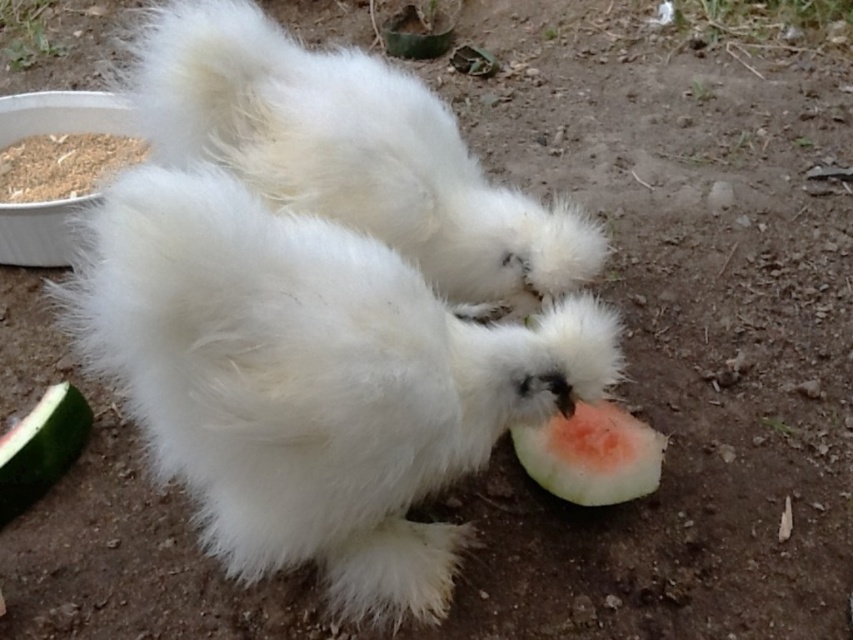
You are standing at the point with coordinates point (86, 413) and want to walk to the point with coordinates point (515, 452). Which direction should you move in?

You should move forward because point (515, 452) is in front of point (86, 413).

You are standing in a farmyard where two fluffy white chickens are pecking at the pink flesh watermelon at lower center. If you want to place a small bowl of chicken feed exactly where the watermelon is, what coordinates should you use?

The coordinates for the pink flesh watermelon at lower center are 0.711 on the x axis and 0.695 on the y axis, so you should place the bowl at those coordinates.

You are a chicken in the image. You want to reach the pink flesh watermelon at lower center. Which direction should you move from your current position at point (592, 454)?

The pink flesh watermelon at lower center is located at point (592, 454), so you are already at the location of the pink flesh watermelon at lower center.